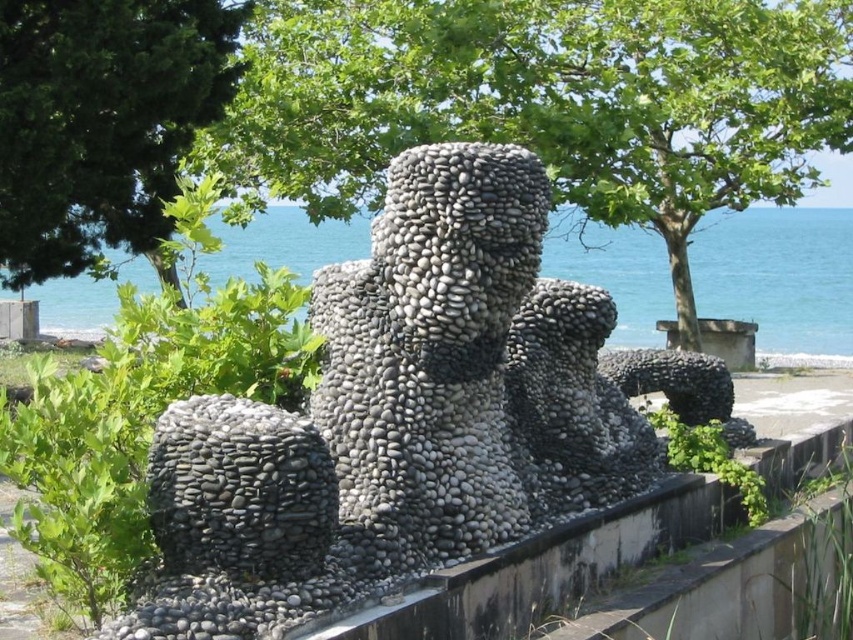
Question: Can you confirm if gray pebble statue at center is positioned to the left of smooth concrete ledge at center?

Choices:
 (A) no
 (B) yes

Answer: (B)

Question: Is green leafy tree at upper left below blue water at center?

Choices:
 (A) yes
 (B) no

Answer: (B)

Question: Which point is farther from the camera taking this photo?

Choices:
 (A) (418, 604)
 (B) (846, 237)
 (C) (125, 93)
 (D) (412, 269)

Answer: (B)

Question: Does blue water at center appear on the left side of smooth concrete ledge at center?

Choices:
 (A) yes
 (B) no

Answer: (A)

Question: Which of the following is the farthest from the observer?

Choices:
 (A) (662, 275)
 (B) (466, 336)
 (C) (250, 61)
 (D) (666, 506)

Answer: (A)

Question: Considering the real-world distances, which object is closest to the green leafy tree at upper center?

Choices:
 (A) green leafy tree at upper left
 (B) gray pebble statue at center
 (C) smooth concrete ledge at center

Answer: (A)